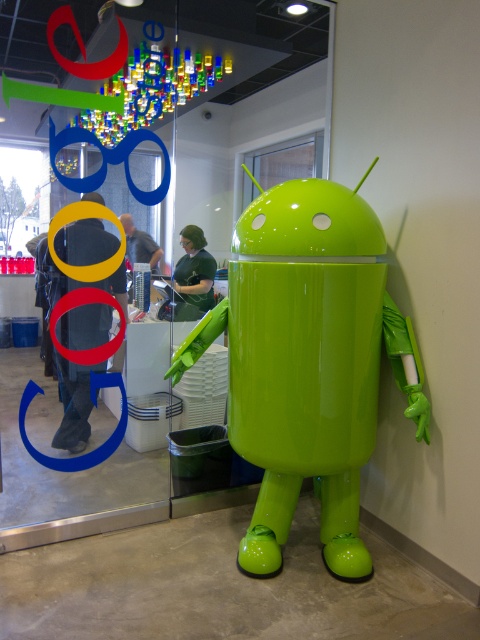
At what (x,y) coordinates should I click in order to perform the action: click on dark gray pants at center. Please return your answer as a coordinate pair (x, y). The width and height of the screenshot is (480, 640). Looking at the image, I should click on (74, 401).

Can you confirm if dark gray pants at center is shorter than green matte shirt at center?

No.

Between point (86, 244) and point (190, 243), which one is positioned behind?

Positioned behind is point (190, 243).

Locate an element on the screen. This screenshot has width=480, height=640. dark gray pants at center is located at coordinates click(x=74, y=401).

Does point (364, 330) come in front of point (95, 342)?

That is True.

Can you confirm if glossy plastic android at center is smaller than dark gray pants at center?

Incorrect, glossy plastic android at center is not smaller in size than dark gray pants at center.

Locate an element on the screen. glossy plastic android at center is located at coordinates (308, 362).

Locate an element on the screen. This screenshot has width=480, height=640. glossy plastic android at center is located at coordinates (308, 362).

Between point (188, 227) and point (135, 241), which one is positioned in front?

Positioned in front is point (135, 241).

Is green matte shirt at center bigger than green glossy android at center?

Indeed, green matte shirt at center has a larger size compared to green glossy android at center.

At what (x,y) coordinates should I click in order to perform the action: click on green matte shirt at center. Please return your answer as a coordinate pair (x, y). This screenshot has width=480, height=640. Looking at the image, I should click on (194, 269).

I want to click on green matte shirt at center, so click(x=194, y=269).